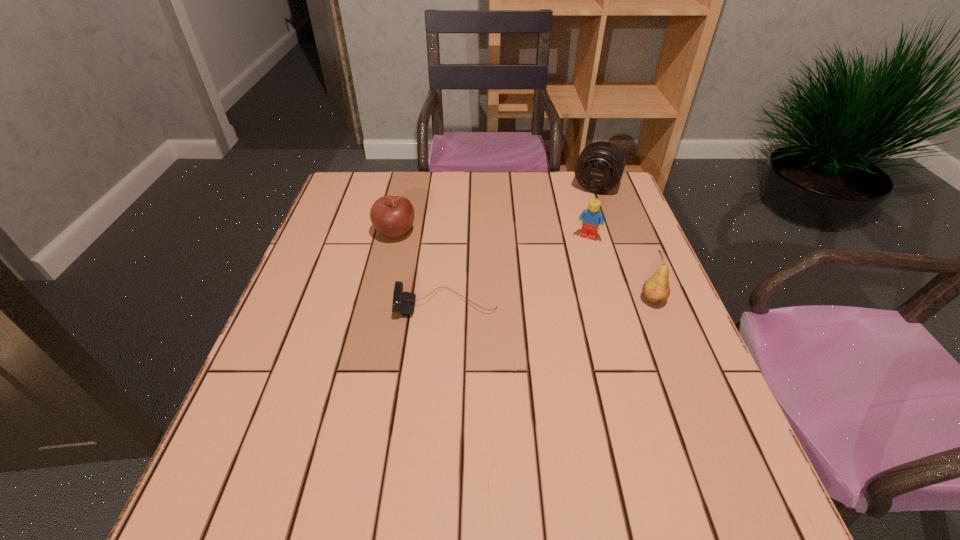
At what (x,y) coordinates should I click in order to perform the action: click on free space on the desktop that is between the shortest object and the pear and is positioned on the front-facing side of the farthest object. Please return your answer as a coordinate pair (x, y). The width and height of the screenshot is (960, 540). Looking at the image, I should click on (551, 302).

Where is `vacant space on the desktop that is between the webcam and the pear and is positioned on the face of the Lego`? The image size is (960, 540). vacant space on the desktop that is between the webcam and the pear and is positioned on the face of the Lego is located at coordinates (561, 302).

At what (x,y) coordinates should I click in order to perform the action: click on free space on the desktop that is between the webcam and the pear and is positioned on the side of the apple with the unique marking. Please return your answer as a coordinate pair (x, y). Looking at the image, I should click on (556, 302).